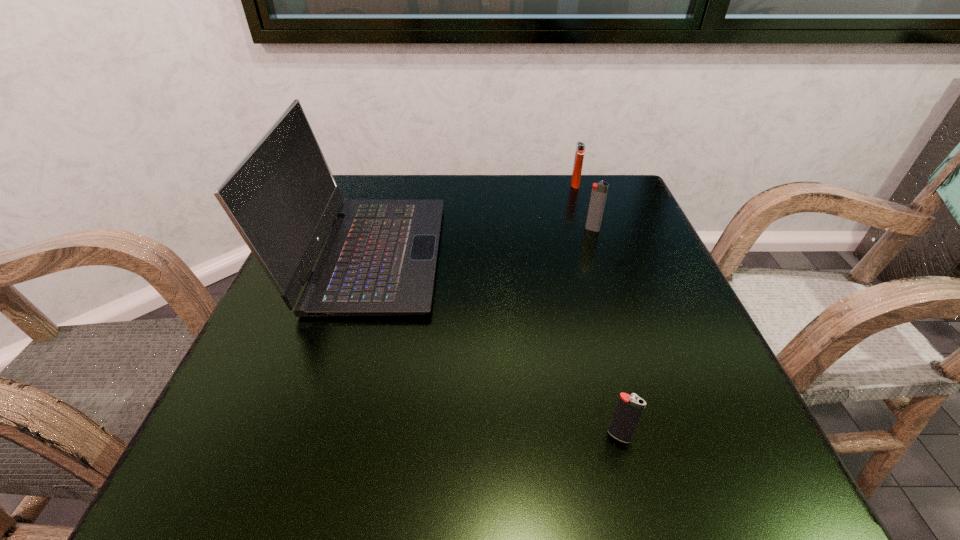
The width and height of the screenshot is (960, 540). Identify the location of vacant area that lies between the second object from left to right and the farthest object. (597, 310).

Point out which object is positioned as the second nearest to the second nearest igniter. Please provide its 2D coordinates. Your answer should be formatted as a tuple, i.e. [(x, y)], where the tuple contains the x and y coordinates of a point satisfying the conditions above.

[(379, 259)]

Identify which object is the third closest to the tallest object. Please provide its 2D coordinates. Your answer should be formatted as a tuple, i.e. [(x, y)], where the tuple contains the x and y coordinates of a point satisfying the conditions above.

[(629, 408)]

Find the location of `igniter object that ranks as the closest to the second farthest igniter`. igniter object that ranks as the closest to the second farthest igniter is located at coordinates (580, 147).

Locate which igniter ranks in proximity to the shortest igniter. Please provide its 2D coordinates. Your answer should be formatted as a tuple, i.e. [(x, y)], where the tuple contains the x and y coordinates of a point satisfying the conditions above.

[(599, 191)]

This screenshot has height=540, width=960. I want to click on vacant point that satisfies the following two spatial constraints: 1. on the back side of the leftmost igniter; 2. on the screen of the laptop computer, so click(572, 254).

Locate an element on the screen. The height and width of the screenshot is (540, 960). vacant region that satisfies the following two spatial constraints: 1. on the screen of the tallest object; 2. on the right side of the leftmost igniter is located at coordinates (313, 436).

Locate an element on the screen. This screenshot has height=540, width=960. blank space that satisfies the following two spatial constraints: 1. on the back side of the farthest igniter; 2. on the right side of the shortest object is located at coordinates (555, 185).

Identify the location of vacant area that satisfies the following two spatial constraints: 1. on the front side of the farthest object; 2. on the screen of the tallest object. (598, 254).

Image resolution: width=960 pixels, height=540 pixels. Identify the location of free point that satisfies the following two spatial constraints: 1. on the screen of the nearest object; 2. on the right side of the laptop computer. (313, 436).